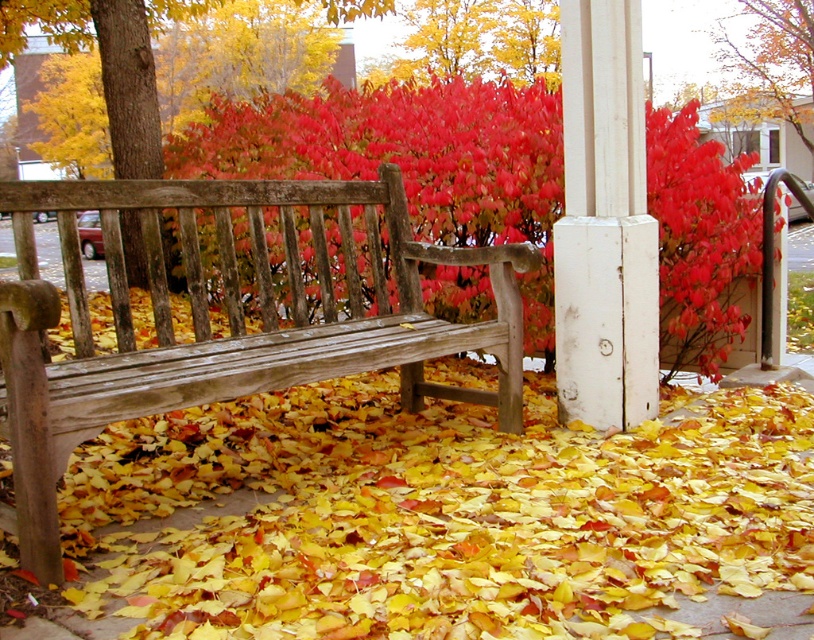
Consider the image. You are planning to place a 2.5 feet wide decorative mat on the ground between the wooden bench at center and the vivid red leaves at center. Based on their widths, can the mat fit between them without overlapping either object?

The wooden bench at center has a lesser width compared to vivid red leaves at center. Since the bench is narrower, the 2.5 feet wide mat may fit between them if the distance between the two objects allows, but the width of the mat itself must be accommodated within the space between their edges. However, the description only provides information about their widths relative to each other, not the distance between them. Therefore, we cannot definitively confirm if the mat will fit without knowing the exact 1

You are planning to place a small potted plant between the yellow wood bench at center and the wooden bench at center. Which bench should the plant be closer to if you want it to be near the one that takes up more space?

The wooden bench at center occupies more space than the yellow wood bench at center, so the plant should be placed closer to the wooden bench at center.